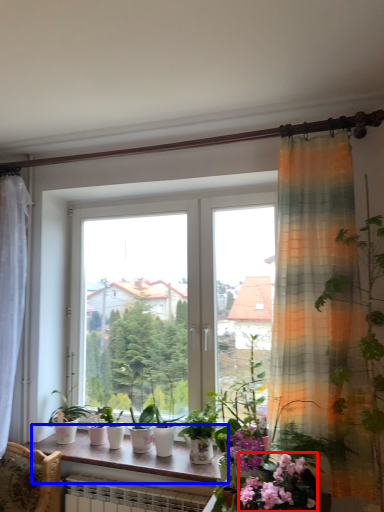
Question: Which of the following is the closest to the observer, flower (highlighted by a red box) or window sill (highlighted by a blue box)?

Choices:
 (A) flower
 (B) window sill

Answer: (A)